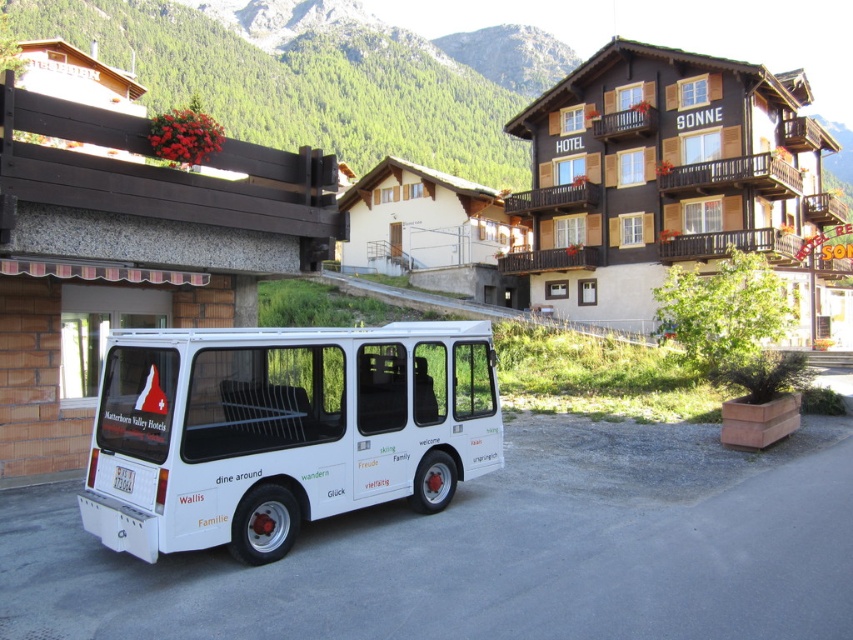
Question: Does white matte van at center appear over brown wooden hotel at upper center?

Choices:
 (A) no
 (B) yes

Answer: (A)

Question: Among these objects, which one is nearest to the camera?

Choices:
 (A) brown wooden hotel at upper center
 (B) white matte van at center

Answer: (B)

Question: Which of these objects is positioned closest to the brown wood overpass at upper left?

Choices:
 (A) brown wooden hotel at upper center
 (B) white matte van at center

Answer: (B)

Question: Is white matte van at center to the left of brown wood overpass at upper left from the viewer's perspective?

Choices:
 (A) no
 (B) yes

Answer: (A)

Question: Is brown wooden hotel at upper center wider than brown wood overpass at upper left?

Choices:
 (A) no
 (B) yes

Answer: (B)

Question: Which of the following is the closest to the observer?

Choices:
 (A) (302, 198)
 (B) (132, 440)
 (C) (677, 67)

Answer: (B)